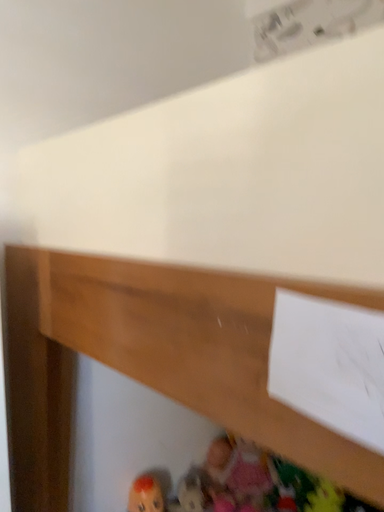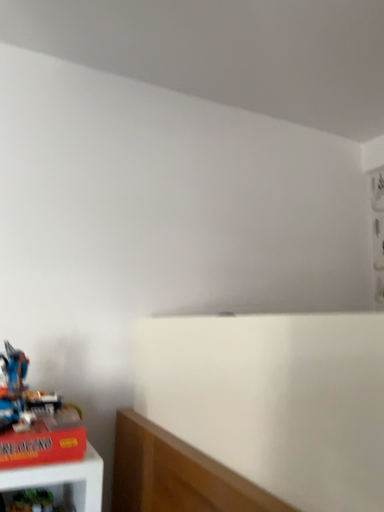
Question: How did the camera likely rotate when shooting the video?

Choices:
 (A) rotated left
 (B) rotated right

Answer: (A)